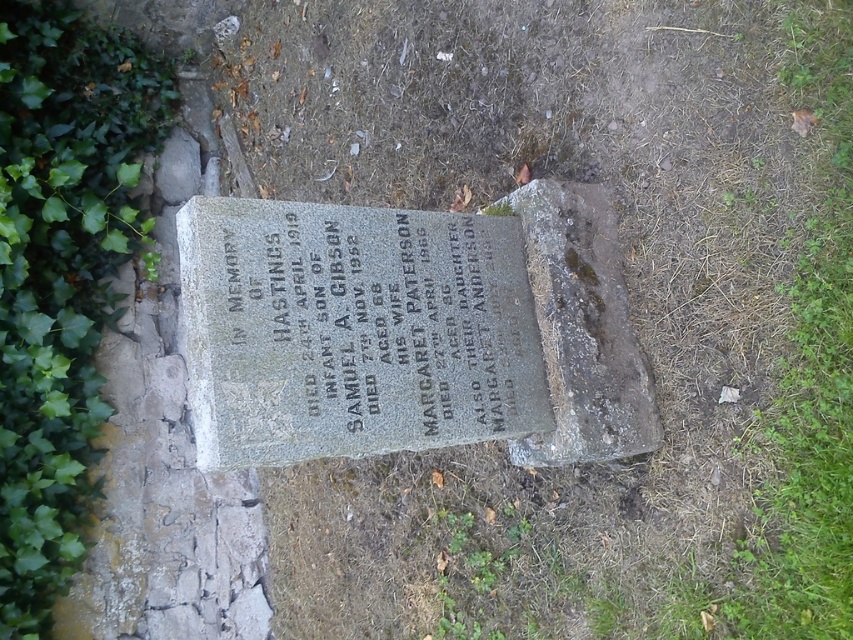
Question: Considering the relative positions of granite inscription at center and green leafy ivy at lower left in the image provided, where is granite inscription at center located with respect to green leafy ivy at lower left?

Choices:
 (A) left
 (B) right

Answer: (B)

Question: Which of the following is the farthest from the observer?

Choices:
 (A) green leafy ivy at lower left
 (B) granite inscription at center

Answer: (A)

Question: Which point is closer to the camera taking this photo?

Choices:
 (A) (263, 388)
 (B) (61, 168)

Answer: (A)

Question: Can you confirm if granite inscription at center is bigger than green leafy ivy at lower left?

Choices:
 (A) no
 (B) yes

Answer: (A)

Question: Is granite inscription at center bigger than green leafy ivy at lower left?

Choices:
 (A) no
 (B) yes

Answer: (A)

Question: Which of the following is the closest to the observer?

Choices:
 (A) (450, 298)
 (B) (64, 468)

Answer: (A)